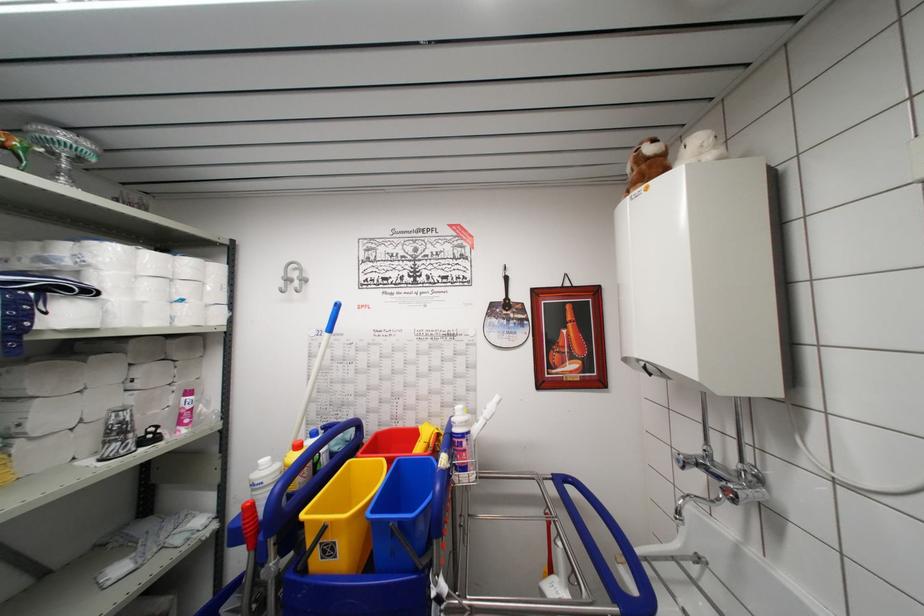
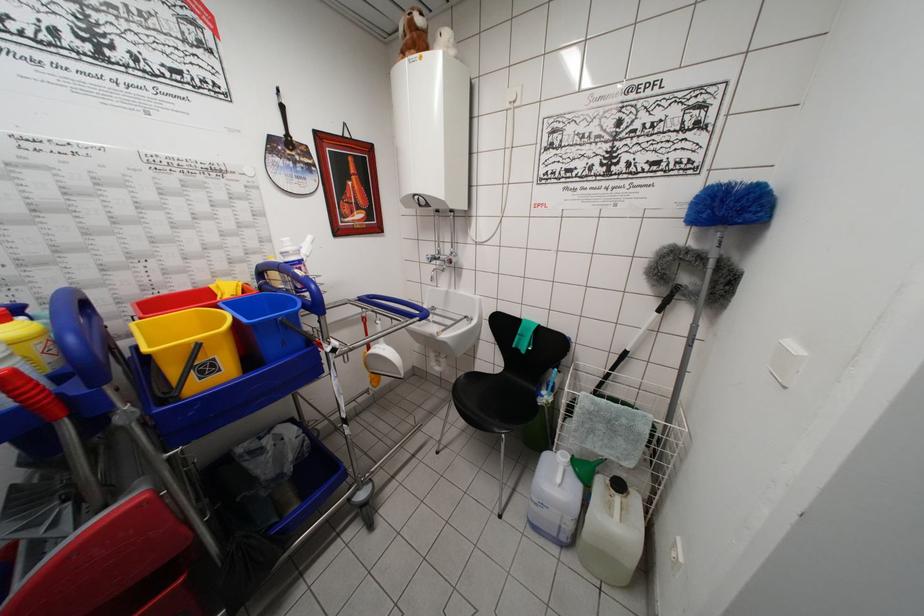
In the second image, find the point that corresponds to [327,530] in the first image.

(200, 349)